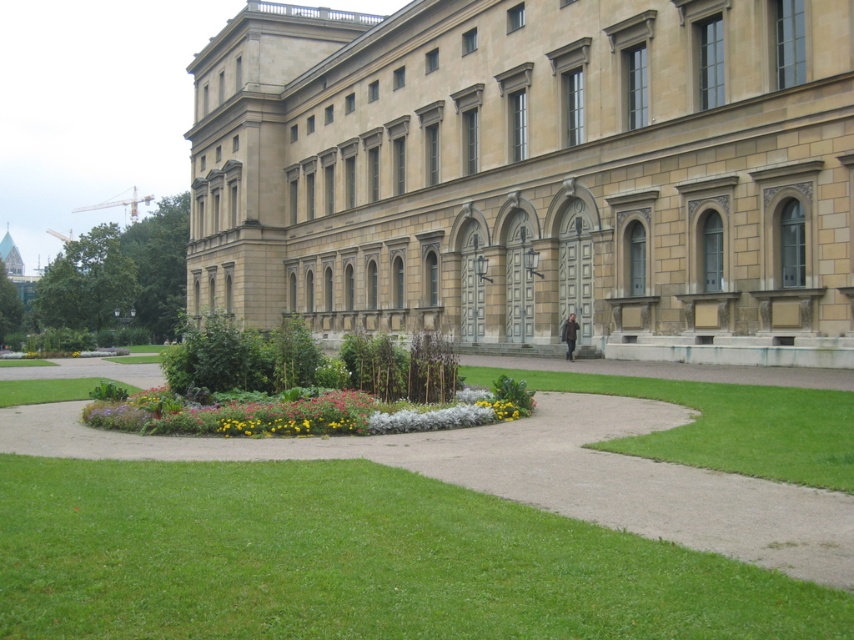
Question: Which point is closer to the camera taking this photo?

Choices:
 (A) (212, 529)
 (B) (212, 106)

Answer: (A)

Question: Is beige stone building at center above green grass at center?

Choices:
 (A) no
 (B) yes

Answer: (B)

Question: Which point is closer to the camera?

Choices:
 (A) (460, 132)
 (B) (477, 538)

Answer: (B)

Question: Considering the relative positions of beige stone building at center and green grass at center in the image provided, where is beige stone building at center located with respect to green grass at center?

Choices:
 (A) left
 (B) right

Answer: (A)

Question: Which object is farther from the camera taking this photo?

Choices:
 (A) green grass at center
 (B) beige stone building at center

Answer: (B)

Question: Does beige stone building at center appear on the left side of green grass at center?

Choices:
 (A) yes
 (B) no

Answer: (A)